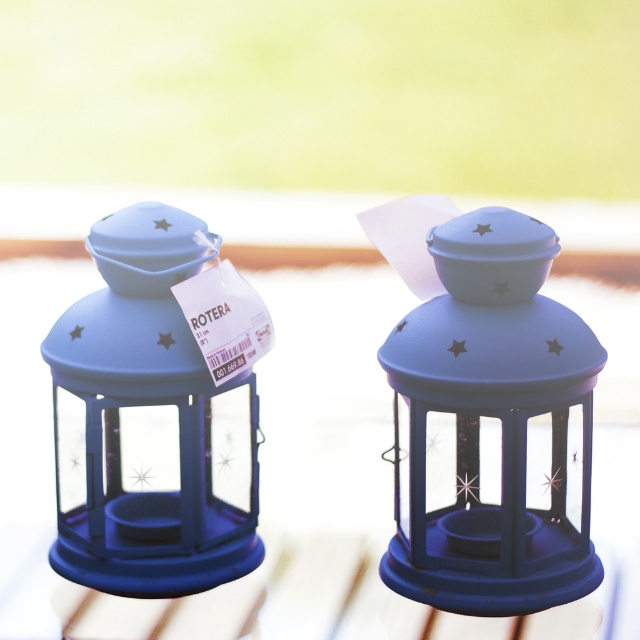
Is matte blue lantern at center wider than matte blue lantern at left?

No, matte blue lantern at center is not wider than matte blue lantern at left.

Measure the distance between matte blue lantern at center and camera.

They are 38.94 inches apart.

Locate an element on the screen. matte blue lantern at center is located at coordinates (492, 428).